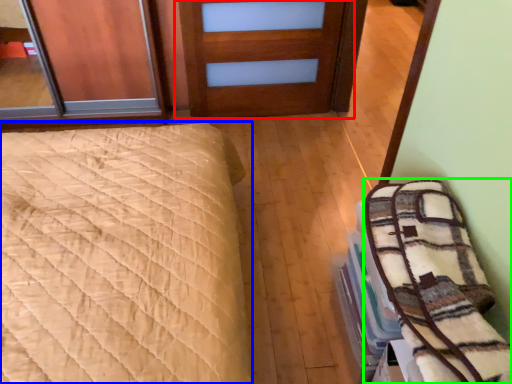
Question: Based on their relative distances, which object is nearer to door (highlighted by a red box)? Choose from bed (highlighted by a blue box) and bedding (highlighted by a green box).

Choices:
 (A) bed
 (B) bedding

Answer: (A)